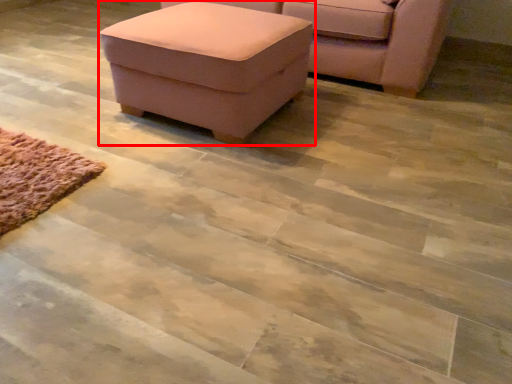
Question: From the image's perspective, where is table (annotated by the red box) located relative to chair?

Choices:
 (A) above
 (B) below

Answer: (B)